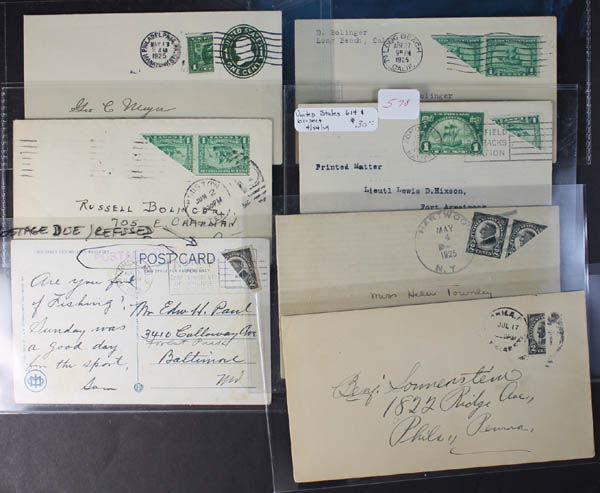
You are a GUI agent. You are given a task and a screenshot of the screen. Output one action in this format:
    pyautogui.click(x=<x>, y=<y>)
    Task: Click on the white sticker with pen inscriptions
    This screenshot has height=493, width=600.
    Given the screenshot: What is the action you would take?
    pyautogui.click(x=333, y=127)